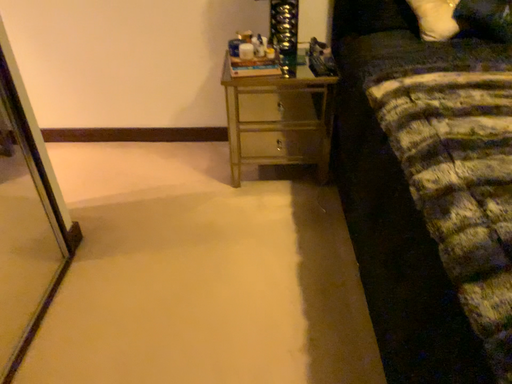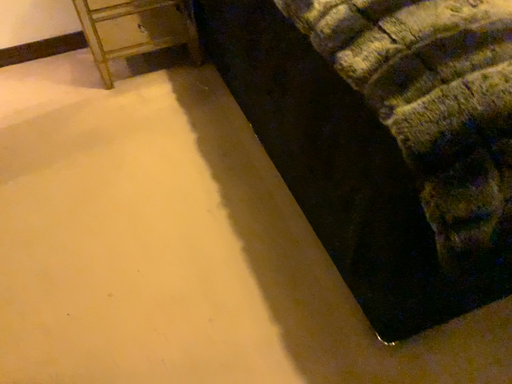
Question: How did the camera likely rotate when shooting the video?

Choices:
 (A) rotated upward
 (B) rotated downward

Answer: (B)